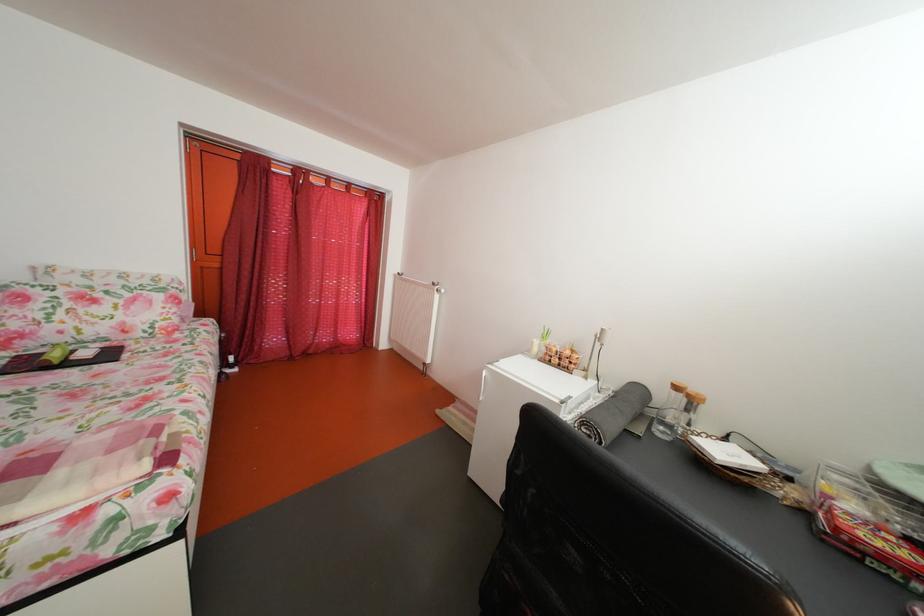
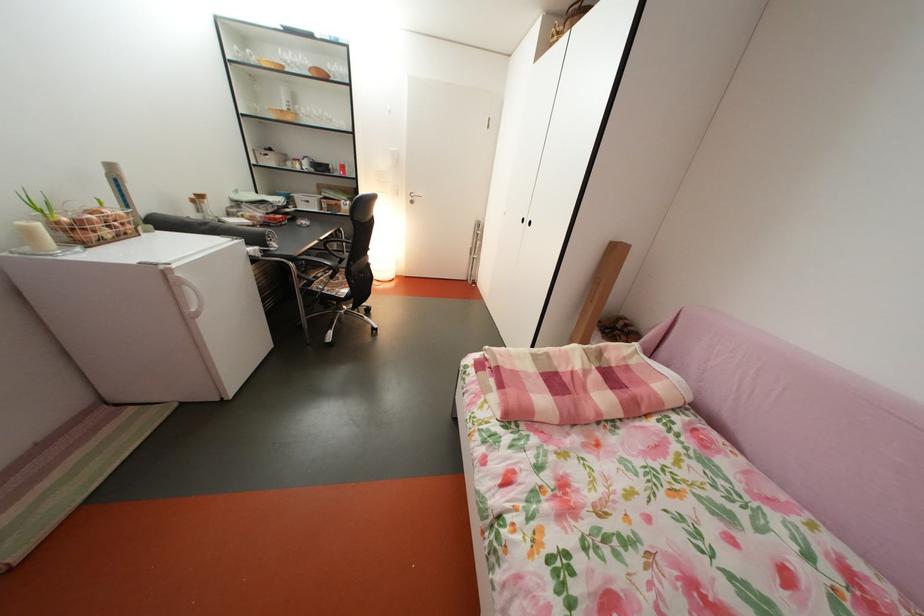
Locate, in the second image, the point that corresponds to [566,367] in the first image.

(118, 238)